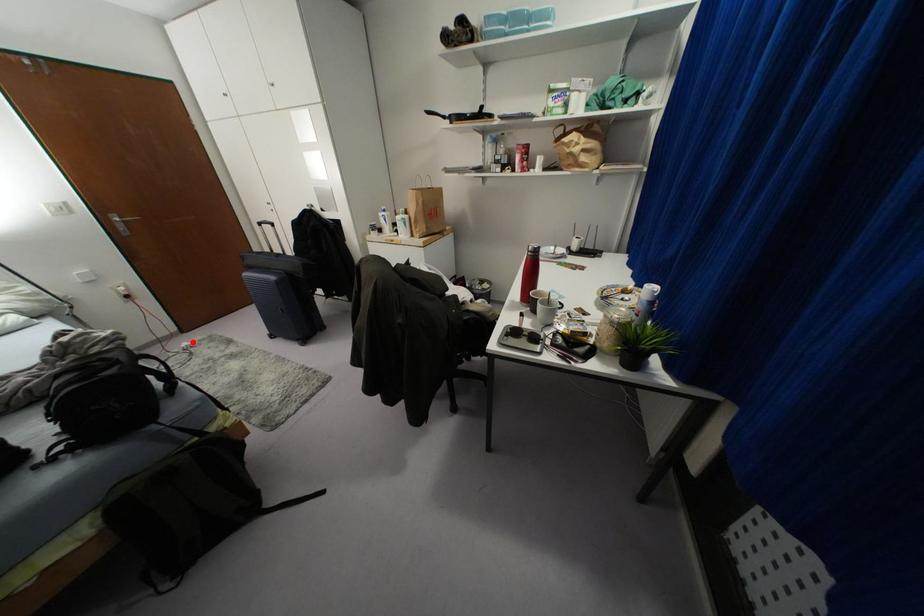
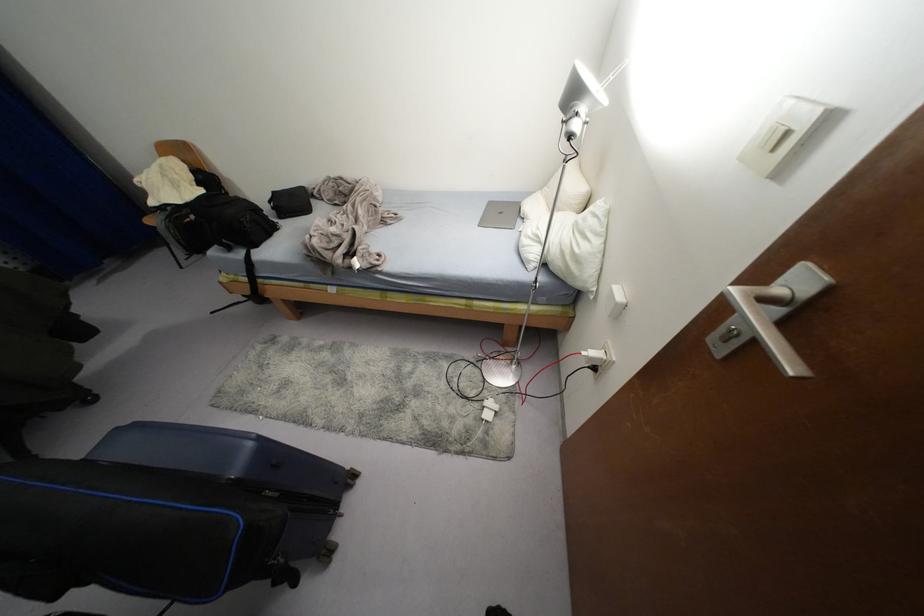
In the second image, find the point that corresponds to the highlighted location in the first image.

(487, 416)